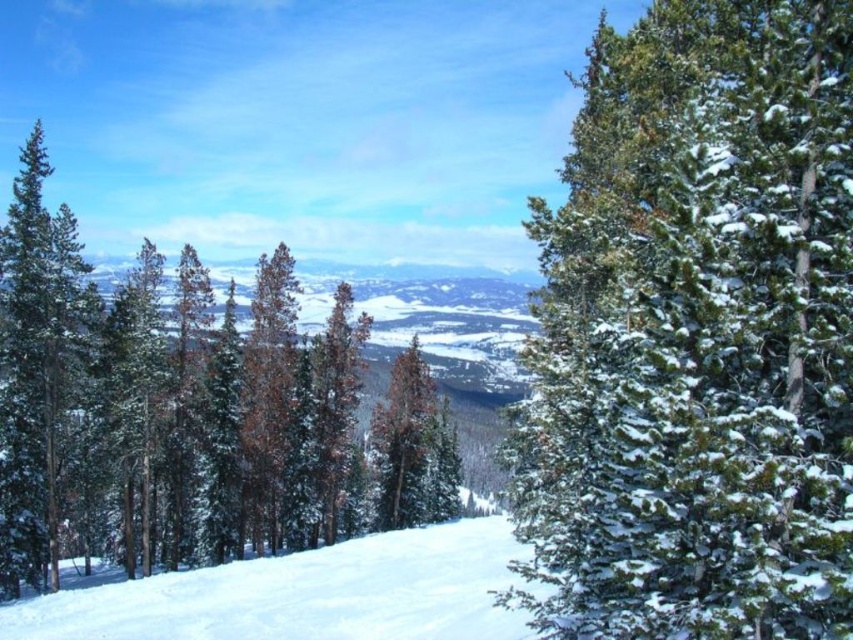
Is green matte evergreen tree at center above white snow at center?

Indeed, green matte evergreen tree at center is positioned over white snow at center.

Find the location of `green matte evergreen tree at center`. green matte evergreen tree at center is located at coordinates (189, 413).

Between white snow at center and green matte evergreen tree at left, which one has more height?

green matte evergreen tree at left is taller.

Who is positioned more to the right, white snow at center or green matte evergreen tree at left?

From the viewer's perspective, white snow at center appears more on the right side.

Where is `white snow at center`? Image resolution: width=853 pixels, height=640 pixels. white snow at center is located at coordinates (305, 595).

Based on the photo, is green matte evergreen tree at center closer to the viewer compared to green matte evergreen tree at left?

Yes, it is in front of green matte evergreen tree at left.

Between point (239, 493) and point (15, 237), which one is positioned in front?

Point (15, 237) is more forward.

Where is `green matte evergreen tree at center`? green matte evergreen tree at center is located at coordinates (189, 413).